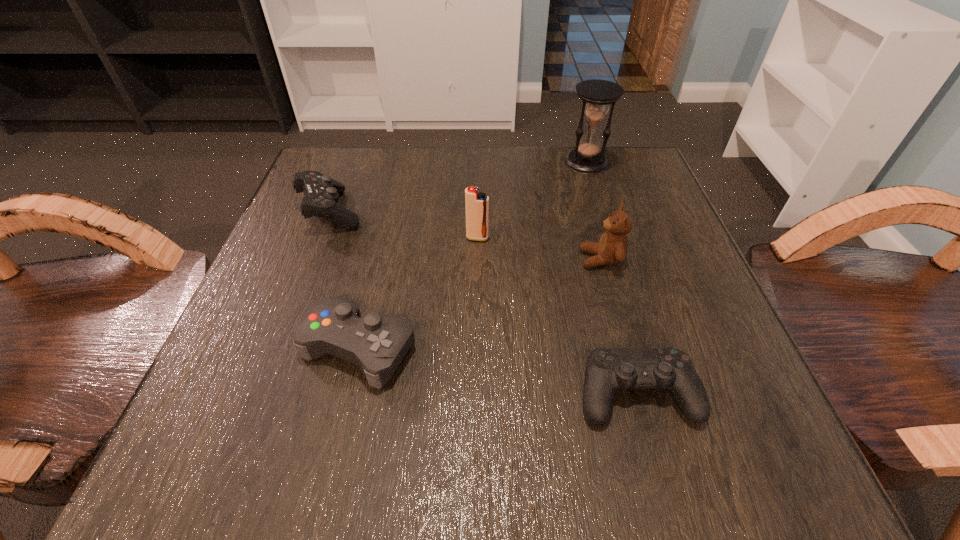
This screenshot has height=540, width=960. Find the location of `vacant space situated 0.350m on the left of the igniter`. vacant space situated 0.350m on the left of the igniter is located at coordinates (276, 238).

Where is `vacant space located on the front of the farthest control`? The image size is (960, 540). vacant space located on the front of the farthest control is located at coordinates (276, 354).

Locate an element on the screen. Image resolution: width=960 pixels, height=540 pixels. free space located on the back of the rightmost control is located at coordinates (601, 263).

Identify the location of hourglass present at the far edge. (596, 95).

This screenshot has width=960, height=540. What are the coordinates of `control positioned at the far edge` in the screenshot? It's located at (321, 192).

Identify the location of object that is at the near edge. The image size is (960, 540). (607, 370).

The height and width of the screenshot is (540, 960). I want to click on hourglass at the right edge, so click(596, 95).

At what (x,y) coordinates should I click in order to perform the action: click on teddy bear present at the right edge. Please return your answer as a coordinate pair (x, y). Looking at the image, I should click on (612, 248).

This screenshot has width=960, height=540. In order to click on control present at the right edge in this screenshot , I will do `click(607, 370)`.

Where is `object located at the far left corner`? object located at the far left corner is located at coordinates (321, 192).